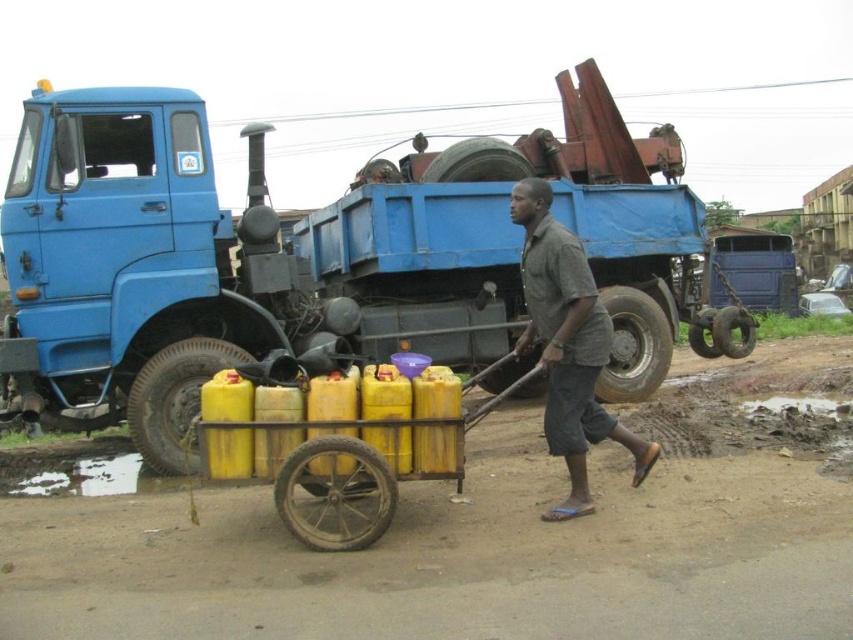
You are standing at the starting point and want to reach the blue matte truck at center. Which direction should you move relative to the yellow matte plastic cart at center?

The blue matte truck at center is to the right of the yellow matte plastic cart at center, so you should move to the right of the yellow matte plastic cart at center to reach the blue matte truck at center.

You are a delivery person who needs to transport a large package. You see the blue matte truck at center and the yellow matte plastic cart at center. Which vehicle can carry the large package more easily?

The yellow matte plastic cart at center can carry the large package more easily since it is larger than the blue matte truck at center according to the description.

You are standing at the point labeled as point (x=532, y=284) and want to walk to the point labeled as point (x=305, y=544). Which direction should you move to get closer to your destination?

To reach point (x=305, y=544) from point (x=532, y=284), you should move downward and to the right because point (x=305, y=544) is closer to the viewer than point (x=532, y=284), indicating it is positioned lower and further right in the image.